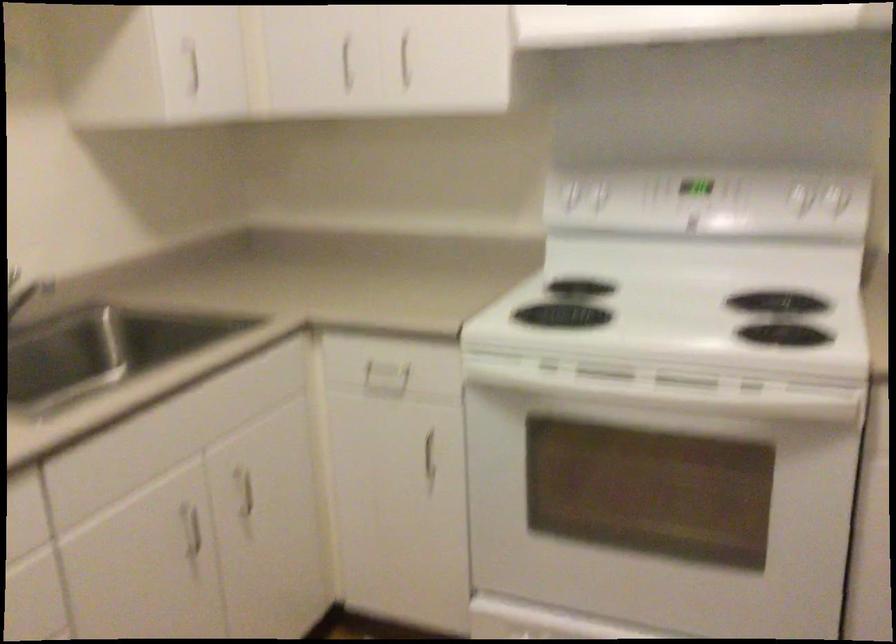
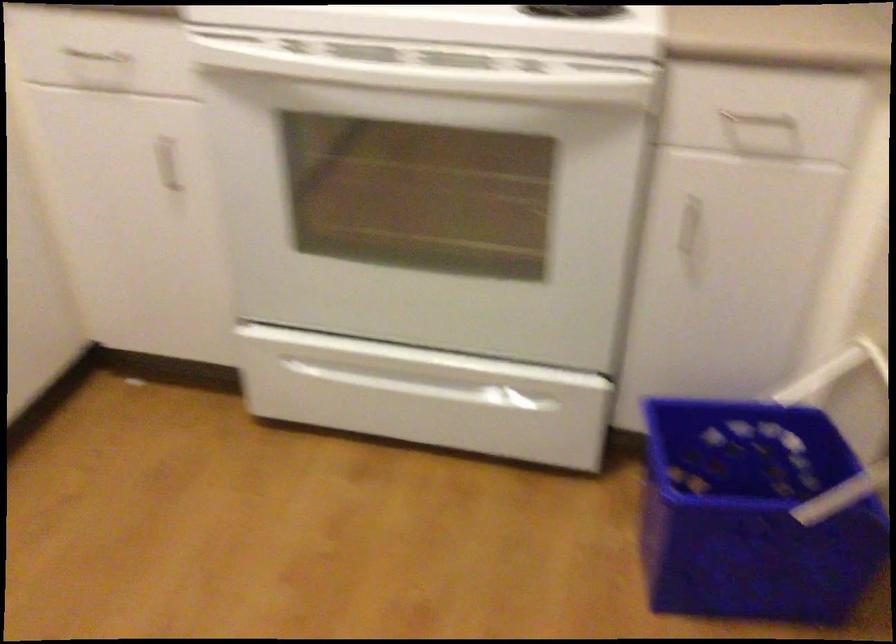
In the second image, find the point that corresponds to (381,359) in the first image.

(97, 57)